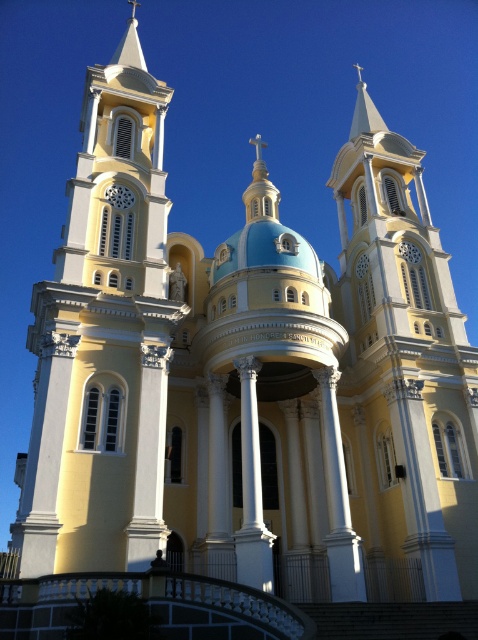
You are standing at the entrance of the church and want to take a photo of the matte yellow tower at center and the white marble column at center. Which object will appear larger in your photo?

The matte yellow tower at center will appear larger in your photo because it is in front of the white marble column at center, making it closer to the camera and thus appear bigger.

You are an architect designing a new building and want to ensure there is enough space between the white glossy column at center and the white marble column at center for a 5 meter wide sculpture. Can the sculpture fit between them?

The white glossy column at center and white marble column at center are 5.44 meters apart, so yes, the 5 meter wide sculpture can fit between them since the distance is sufficient.